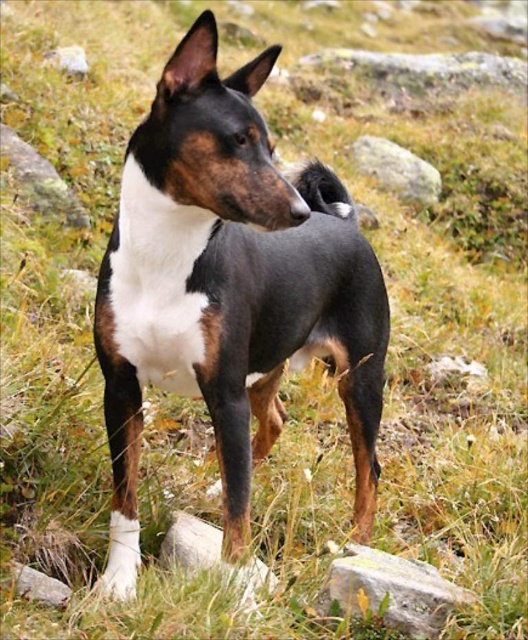
Question: Which point is closer to the camera?

Choices:
 (A) black glossy dog at center
 (B) white smooth rock at lower center

Answer: (A)

Question: Which point appears closest to the camera in this image?

Choices:
 (A) (344, 579)
 (B) (409, 164)

Answer: (A)

Question: Is white smooth rock at lower center bigger than gray rock at lower left?

Choices:
 (A) no
 (B) yes

Answer: (B)

Question: Where is gray rough rock at lower center located in relation to gray rock at upper center in the image?

Choices:
 (A) below
 (B) above

Answer: (A)

Question: Can you confirm if gray rock at upper center is positioned to the right of gray rock at lower left?

Choices:
 (A) yes
 (B) no

Answer: (A)

Question: Which of the following is the farthest from the observer?

Choices:
 (A) (369, 586)
 (B) (62, 584)

Answer: (B)